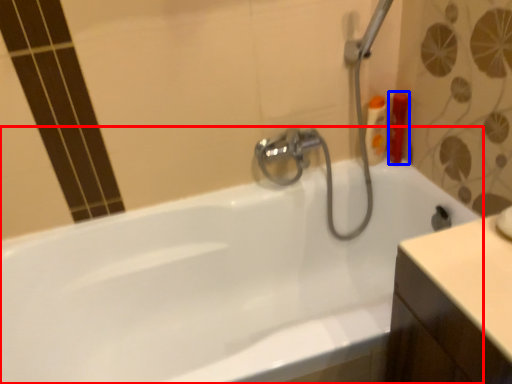
Question: Among these objects, which one is farthest to the camera, bathtub (highlighted by a red box) or toiletry (highlighted by a blue box)?

Choices:
 (A) bathtub
 (B) toiletry

Answer: (B)